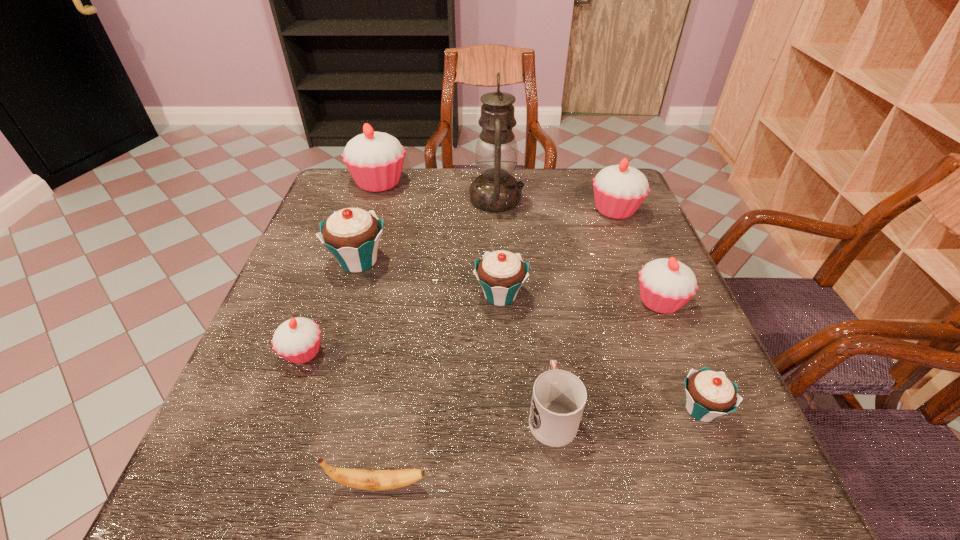
The height and width of the screenshot is (540, 960). I want to click on the smallest pink cupcake, so click(x=297, y=340).

What are the coordinates of `the rightmost teal cupcake` in the screenshot? It's located at (709, 394).

The width and height of the screenshot is (960, 540). Find the location of `the smallest teal cupcake`. the smallest teal cupcake is located at coordinates (709, 394).

In order to click on banana in this screenshot , I will do `click(356, 478)`.

Identify the location of yellow banana. This screenshot has width=960, height=540. (356, 478).

Find the location of a particular element. This screenshot has height=540, width=960. vacant space situated on the right of the tallest object is located at coordinates (591, 199).

Identify the location of free point located on the front of the tallest cupcake. The image size is (960, 540). tap(356, 254).

Where is `vacant space located on the front of the third smallest pink cupcake`? This screenshot has height=540, width=960. vacant space located on the front of the third smallest pink cupcake is located at coordinates (641, 276).

What are the coordinates of `vacant area located 0.380m on the right of the biggest teal cupcake` in the screenshot? It's located at (x=550, y=261).

Where is `vacant space located on the left of the second smallest pink cupcake`? The image size is (960, 540). vacant space located on the left of the second smallest pink cupcake is located at coordinates (511, 301).